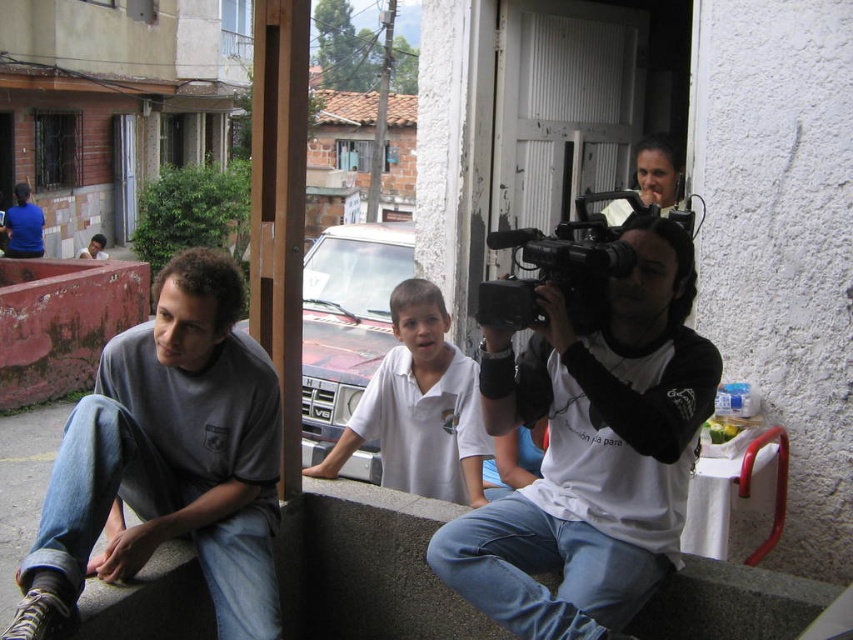
From the picture: What object is located at the coordinates point [167,460]?

The point [167,460] corresponds to the gray cotton shirt at left.

Based on the coordinates provided, where is the gray cotton shirt at left located in the image?

The gray cotton shirt at left is located at the coordinates point (x=167, y=460) in the image.

You are a photographer who wants to capture a photo of the gray cotton shirt at left and the black plastic video camera at center. Based on their positions, which object should you focus on first to ensure both are in the frame?

The gray cotton shirt at left is below the black plastic video camera at center, so you should focus on the black plastic video camera at center first to ensure both are in the frame.